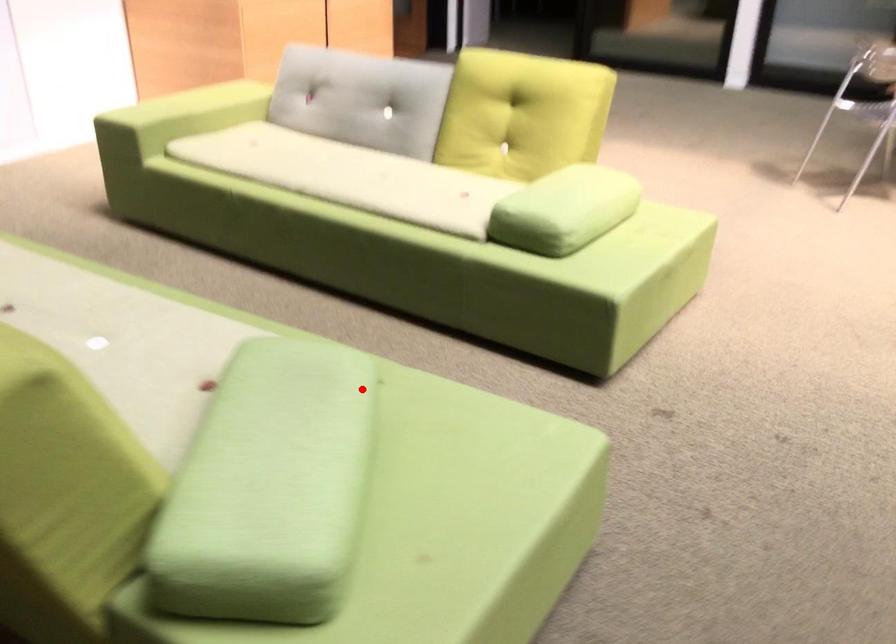
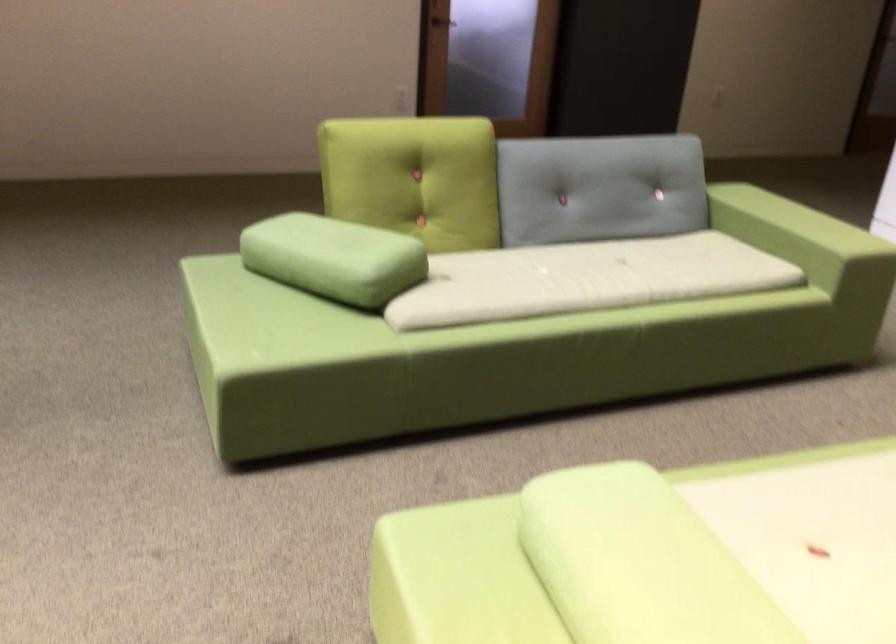
Find the pixel in the second image that matches the highlighted location in the first image.

(333, 258)